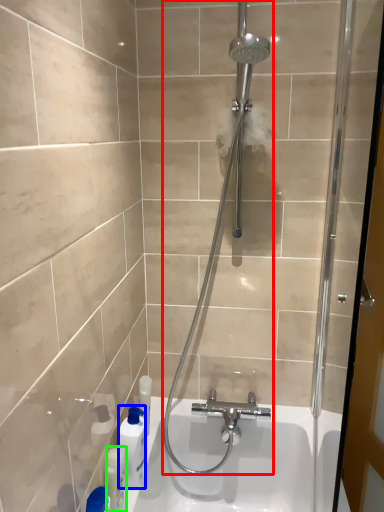
Question: Which object is the closest to the shower (highlighted by a red box)? Choose among these: cleaning product (highlighted by a blue box) or toiletry (highlighted by a green box).

Choices:
 (A) cleaning product
 (B) toiletry

Answer: (A)